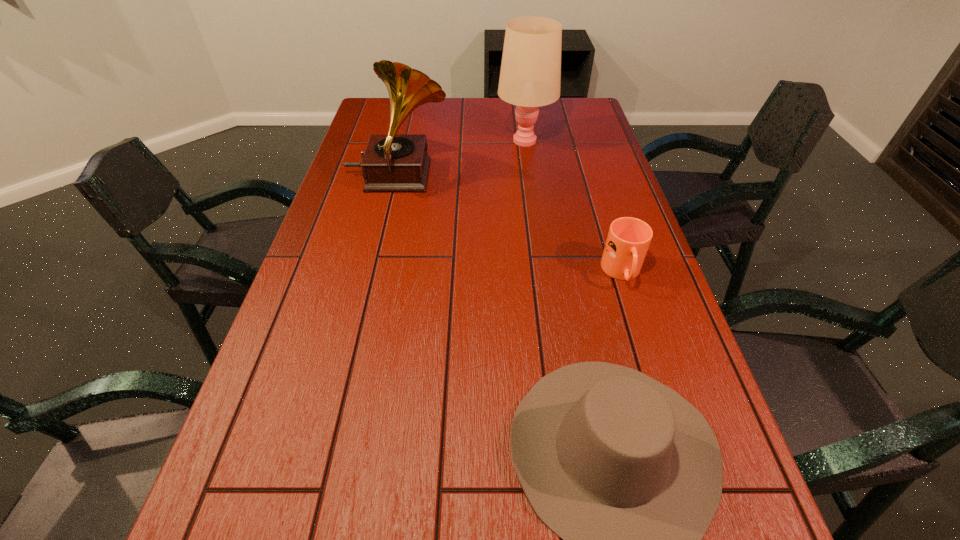
This screenshot has width=960, height=540. Identify the location of vacant space at the far edge of the desktop. (451, 104).

Identify the location of blank space at the left edge of the desktop. The width and height of the screenshot is (960, 540). (297, 409).

The height and width of the screenshot is (540, 960). I want to click on vacant point at the right edge, so click(x=661, y=383).

In the image, there is a desktop. Where is `vacant space at the far left corner`? This screenshot has height=540, width=960. vacant space at the far left corner is located at coordinates (390, 116).

Find the location of `free space at the far right corner`. free space at the far right corner is located at coordinates (562, 109).

Locate an element on the screen. unoccupied position between the lampshade and the second farthest object is located at coordinates (462, 158).

The height and width of the screenshot is (540, 960). In order to click on vacant space that's between the farthest object and the mug in this screenshot , I will do `click(574, 206)`.

Where is `vacant region between the farthest object and the third farthest object`? Image resolution: width=960 pixels, height=540 pixels. vacant region between the farthest object and the third farthest object is located at coordinates (574, 206).

Identify the location of free point between the leftmost object and the farthest object. (462, 158).

Select which object is the third closest to the farthest object. Please provide its 2D coordinates. Your answer should be formatted as a tuple, i.e. [(x, y)], where the tuple contains the x and y coordinates of a point satisfying the conditions above.

[(628, 473)]